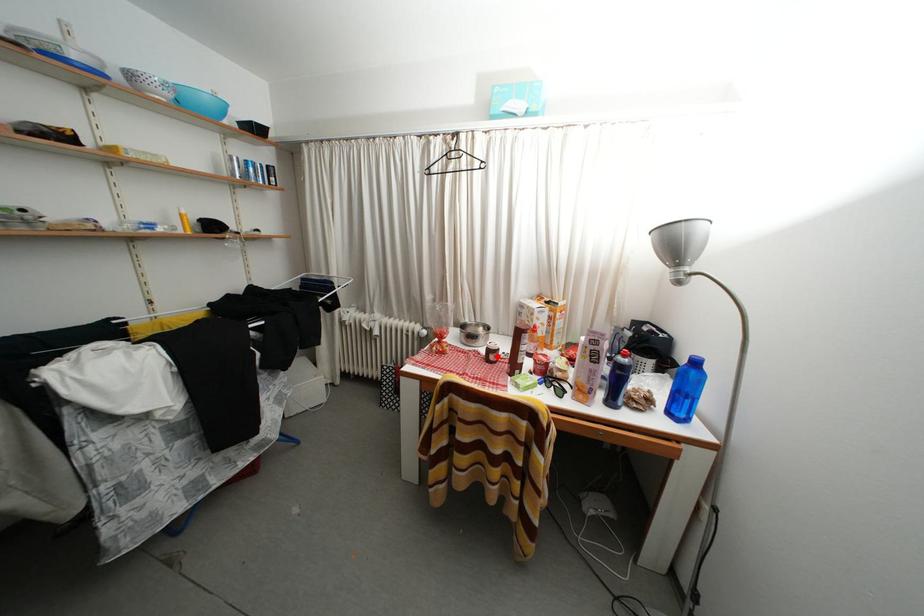
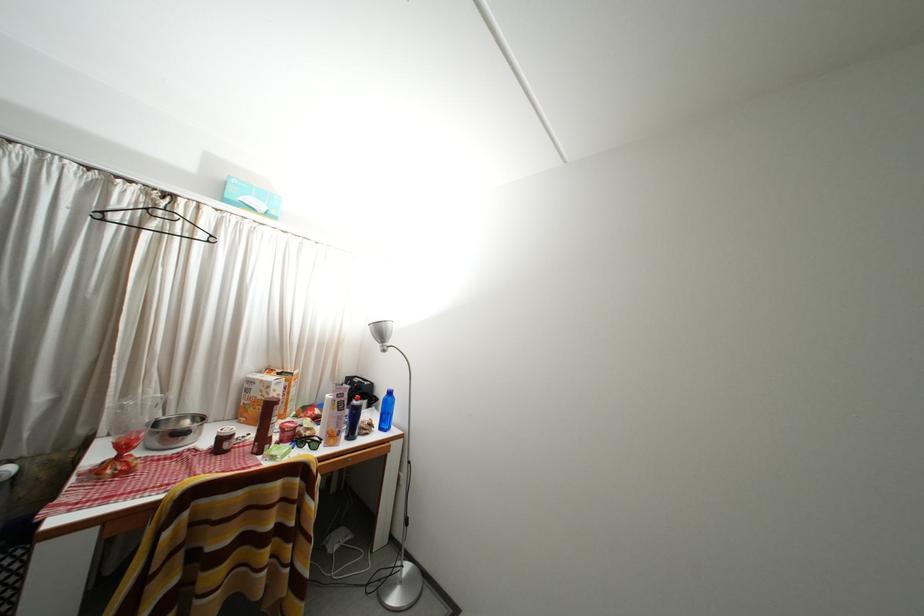
Find the pixel in the second image that matches the highlighted location in the first image.

(229, 445)